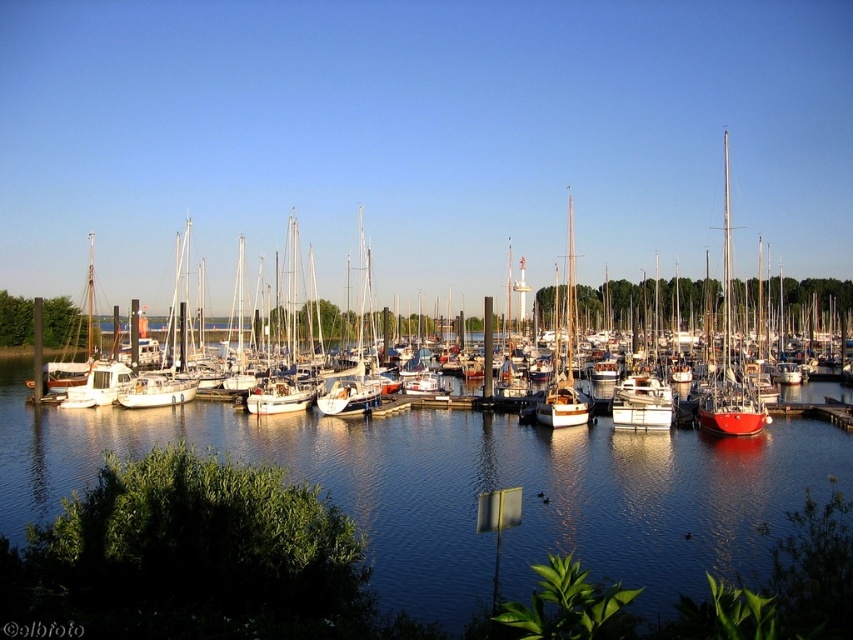
Does clear blue water at center have a lesser height compared to white matte sailboat at center?

Yes.

Consider the image. Can you confirm if clear blue water at center is positioned to the left of white matte sailboat at center?

No, clear blue water at center is not to the left of white matte sailboat at center.

What are the coordinates of `clear blue water at center` in the screenshot? It's located at (467, 490).

This screenshot has height=640, width=853. What are the coordinates of `clear blue water at center` in the screenshot? It's located at (467, 490).